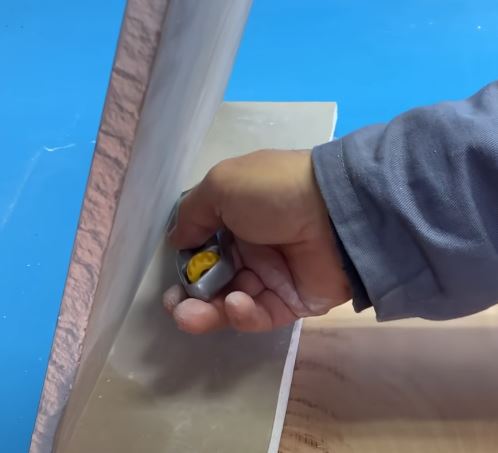
Locate an element on the screen. This screenshot has width=498, height=453. bend in sheetrock is located at coordinates tap(122, 327).